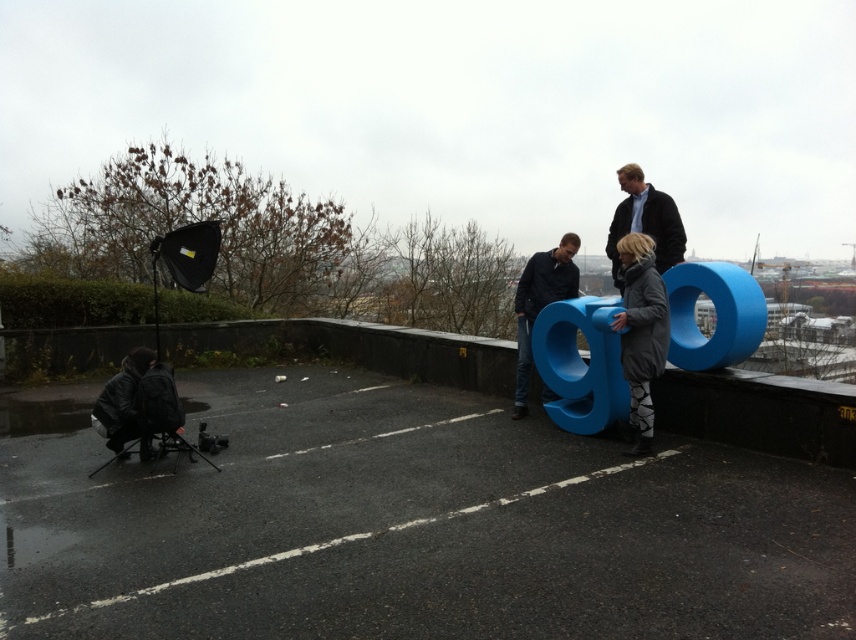
Is dark blue jacket at upper center to the right of leather jacket at lower left from the viewer's perspective?

Correct, you'll find dark blue jacket at upper center to the right of leather jacket at lower left.

In order to click on dark blue jacket at upper center in this screenshot , I will do `click(645, 221)`.

Which of these two, gray woolen coat at center or matte black backpack at lower left, stands taller?

Standing taller between the two is gray woolen coat at center.

Can you confirm if gray woolen coat at center is wider than matte black backpack at lower left?

Yes.

Is point (658, 330) closer to viewer compared to point (141, 445)?

Yes, it is.

Where is `gray woolen coat at center`? This screenshot has height=640, width=856. gray woolen coat at center is located at coordinates (642, 332).

Based on the photo, is blue rubber letter at center to the left of leather jacket at lower left from the viewer's perspective?

In fact, blue rubber letter at center is to the right of leather jacket at lower left.

Based on the photo, can you confirm if blue rubber letter at center is positioned above leather jacket at lower left?

Indeed, blue rubber letter at center is positioned over leather jacket at lower left.

Which is behind, point (536, 298) or point (131, 438)?

Point (536, 298)

The image size is (856, 640). I want to click on blue rubber letter at center, so click(539, 304).